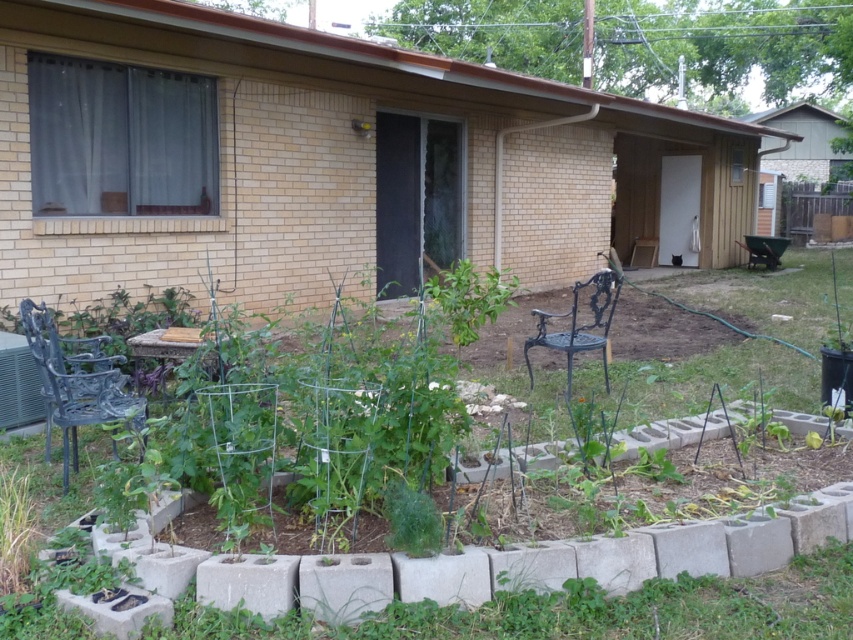
In the scene shown: You are standing in the backyard garden and want to move from the green wire trellis at center to the matte black chair at left. Which direction should you move to get closer to the chair?

Since the green wire trellis at center is closer to the viewer than the matte black chair at left, you should move backward to reach the matte black chair at left.

You are standing in the backyard garden and want to place a new plant exactly at the center of the green wire trellis at center. What are the coordinates where you should place it?

The coordinates for the center of the green wire trellis at center are at point (x=648, y=612).